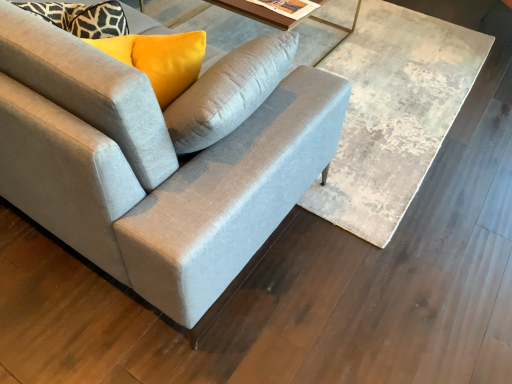
Locate an element on the screen. This screenshot has width=512, height=384. free space underneath wooden textured table at center (from a real-world perspective) is located at coordinates click(x=378, y=86).